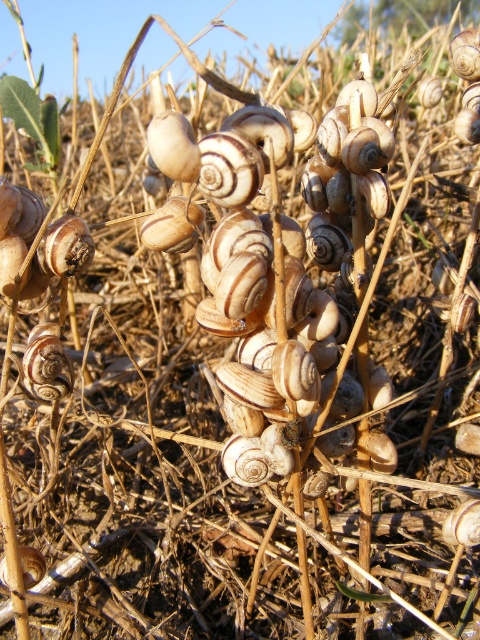
You are a biologist studying the arrangement of snail shells in the image. You notice a specific point marked at coordinates point (285, 266). Which shell is located exactly at this point?

The matte beige shell at center is located at point (285, 266).

From the picture: You are a collector examining the cluster of snail shells on the dried plant stalks. You notice two shells, the matte beige shell at center and the matte white shell at center. Which shell would appear larger to you if you look at them from your current position?

The matte beige shell at center appears larger because it is closer to the viewer than the matte white shell at center.